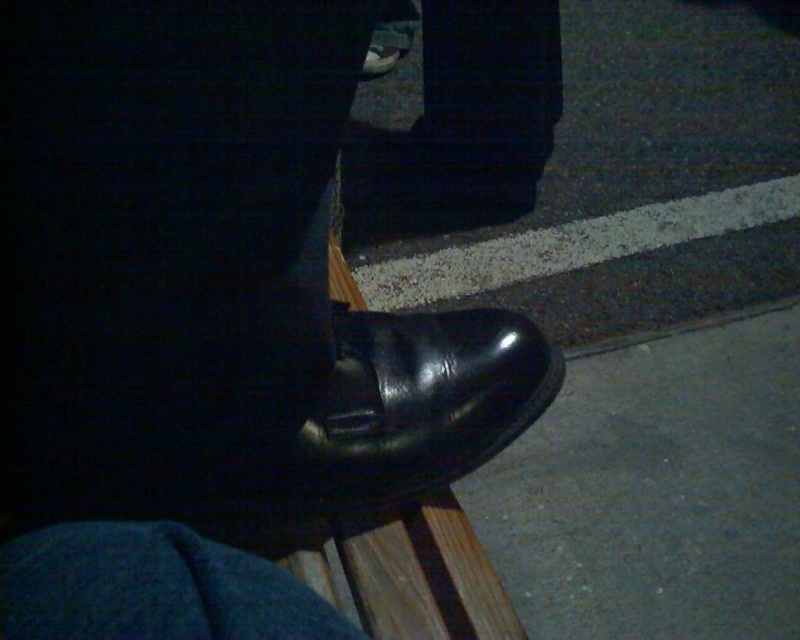
Question: Is shiny black shoe at center above black leather shoe at center?

Choices:
 (A) yes
 (B) no

Answer: (B)

Question: Considering the real-world distances, which object is closest to the black rubber shoe at lower right?

Choices:
 (A) shiny black shoe at center
 (B) black leather shoe at center

Answer: (B)

Question: Estimate the real-world distances between objects in this image. Which object is farther from the shiny black shoe at center?

Choices:
 (A) black leather shoe at center
 (B) black rubber shoe at lower right

Answer: (B)

Question: Can you confirm if shiny black shoe at center is smaller than black rubber shoe at lower right?

Choices:
 (A) no
 (B) yes

Answer: (B)

Question: Which of the following is the farthest from the observer?

Choices:
 (A) black rubber shoe at lower right
 (B) black leather shoe at center
 (C) shiny black shoe at center

Answer: (A)

Question: Does black rubber shoe at lower right appear under black leather shoe at center?

Choices:
 (A) yes
 (B) no

Answer: (A)